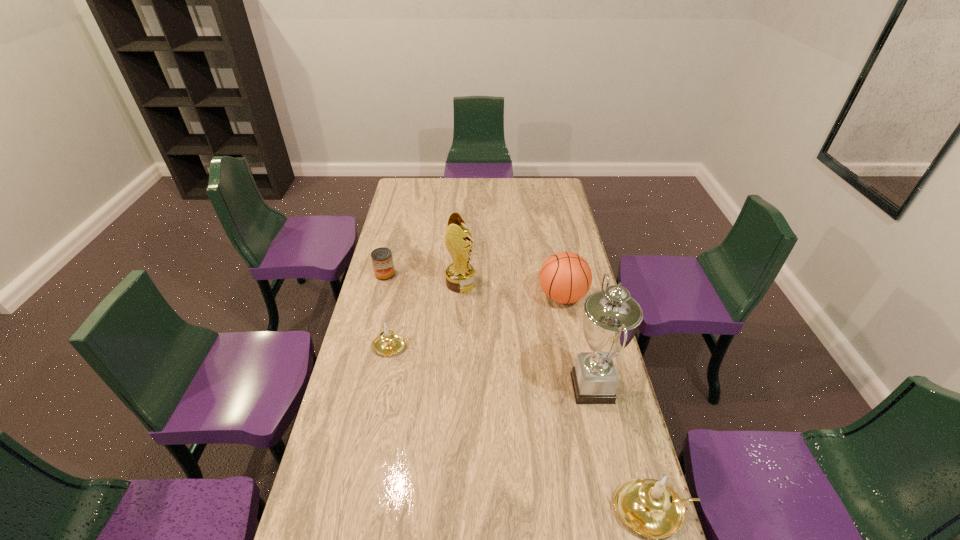
Where is `the shorter candle holder`? The width and height of the screenshot is (960, 540). the shorter candle holder is located at coordinates (388, 343).

At what (x,y) coordinates should I click in order to perform the action: click on the left candle holder. Please return your answer as a coordinate pair (x, y). Looking at the image, I should click on (388, 343).

Find the location of a particular element. the fourth object from right to left is located at coordinates (460, 275).

I want to click on award, so pyautogui.click(x=460, y=275).

Where is `basketball`? This screenshot has width=960, height=540. basketball is located at coordinates (565, 277).

Where is `can`? This screenshot has width=960, height=540. can is located at coordinates (382, 260).

The width and height of the screenshot is (960, 540). Identify the location of the tallest object. (611, 317).

The width and height of the screenshot is (960, 540). I want to click on free region located 0.220m on the handle side of the shorter candle holder, so click(x=473, y=347).

Where is `vacant region located on the front-facing side of the fourth object from right to left`? vacant region located on the front-facing side of the fourth object from right to left is located at coordinates (543, 284).

You are a GUI agent. You are given a task and a screenshot of the screen. Output one action in this format:
    pyautogui.click(x=<x>, y=<y>)
    Task: Click on the vacant region located on the left of the basketball
    This screenshot has height=540, width=960.
    Given the screenshot: What is the action you would take?
    pyautogui.click(x=472, y=296)